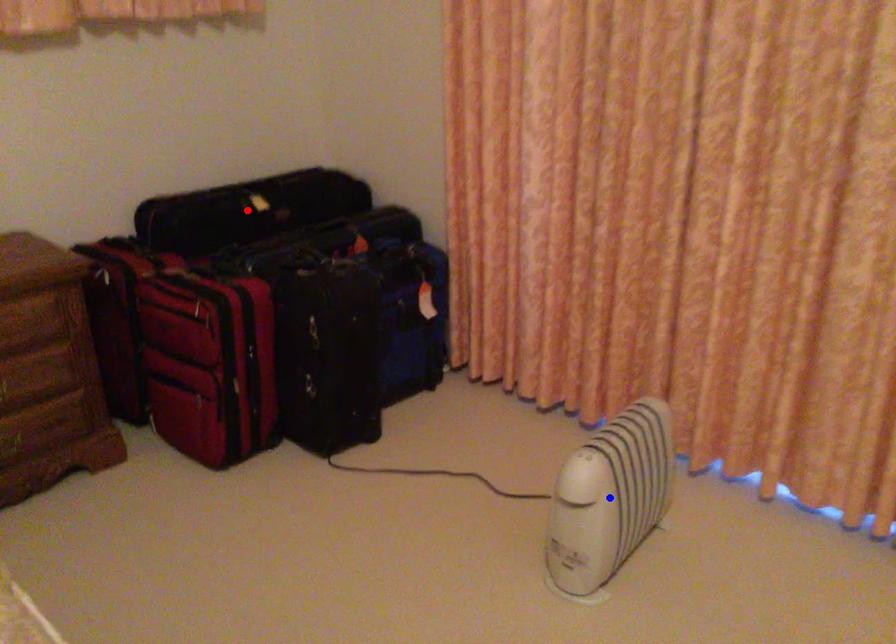
Question: In the image, two points are highlighted. Which point is nearer to the camera? Reply with the corresponding letter.

Choices:
 (A) blue point
 (B) red point

Answer: (A)